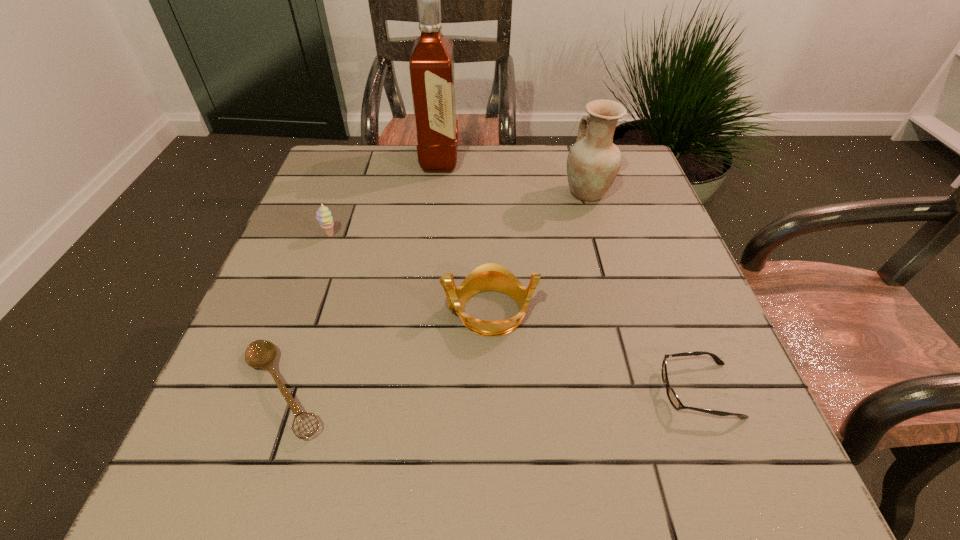
The width and height of the screenshot is (960, 540). I want to click on the farthest object, so click(x=432, y=72).

At what (x,y) coordinates should I click in order to perform the action: click on the tallest object. Please return your answer as a coordinate pair (x, y). Looking at the image, I should click on (432, 72).

Locate an element on the screen. The image size is (960, 540). the fifth nearest object is located at coordinates (593, 162).

Where is `pottery`? The width and height of the screenshot is (960, 540). pottery is located at coordinates (593, 162).

Locate an element on the screen. The image size is (960, 540). the fourth farthest object is located at coordinates (491, 276).

The height and width of the screenshot is (540, 960). Identify the location of the fourth nearest object. (324, 217).

At what (x,y) coordinates should I click in order to perform the action: click on sherbert. Please return your answer as a coordinate pair (x, y). The width and height of the screenshot is (960, 540). Looking at the image, I should click on (324, 217).

Where is `spectacles`? The width and height of the screenshot is (960, 540). spectacles is located at coordinates point(673,398).

Locate an element on the screen. ladle is located at coordinates click(x=261, y=353).

In order to click on vacant region located on the front label of the farthest object in this screenshot , I will do `click(588, 160)`.